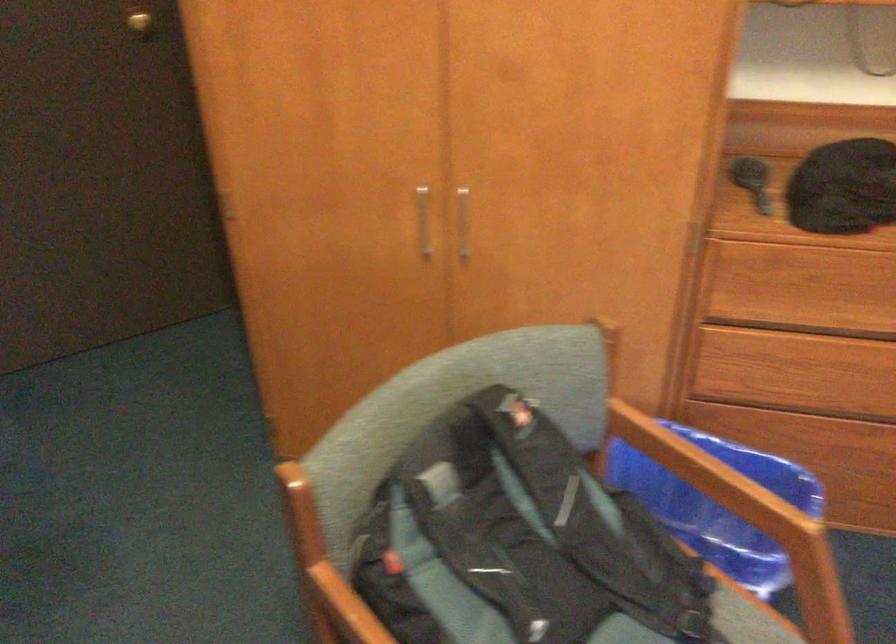
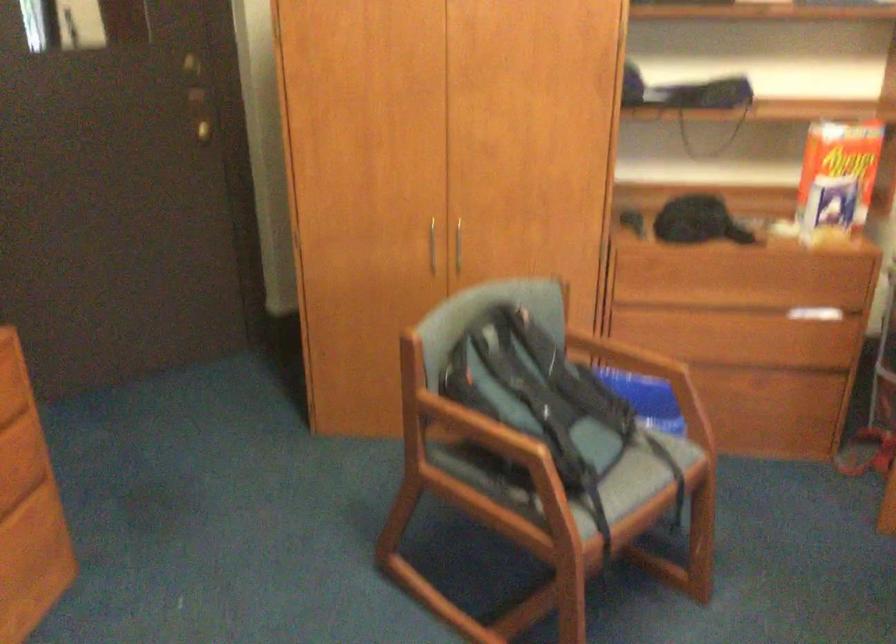
In a continuous first-person perspective shot, in which direction is the camera moving?

The movement direction of the cameraman is left, backward.